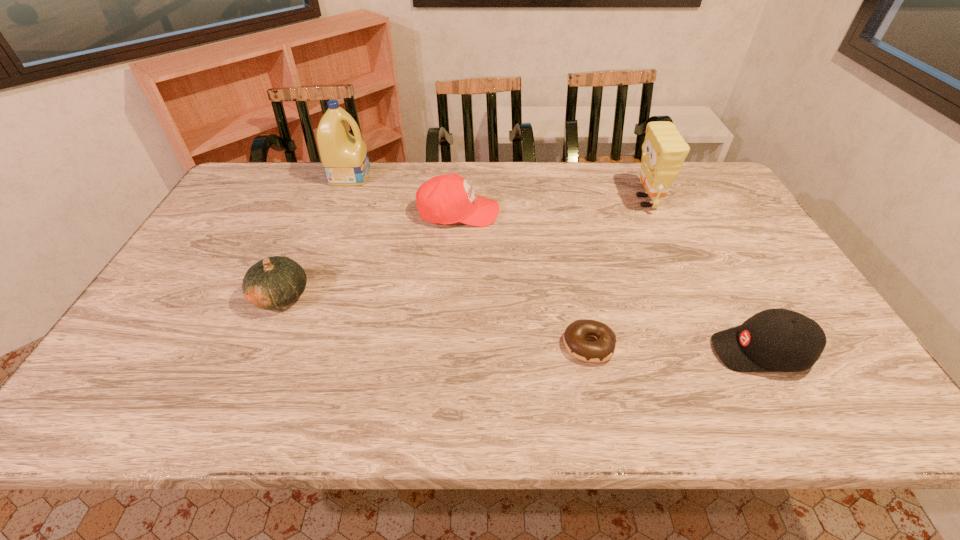
Locate an element on the screen. This screenshot has width=960, height=540. vacant space situated on the face of the sponge is located at coordinates (546, 201).

I want to click on free region located on the face of the sponge, so click(x=515, y=201).

This screenshot has width=960, height=540. Identify the location of vacant area situated 0.220m on the face of the sponge. (562, 201).

This screenshot has height=540, width=960. Find the location of `free space located 0.360m on the front panel of the left baseball cap`. free space located 0.360m on the front panel of the left baseball cap is located at coordinates (614, 213).

I want to click on vacant space located on the back of the gourd, so click(321, 205).

This screenshot has width=960, height=540. I want to click on vacant space located 0.250m with a logo on the front of the nearer baseball cap, so click(604, 352).

This screenshot has height=540, width=960. Find the location of `vacant space located 0.390m with a logo on the front of the nearer baseball cap`. vacant space located 0.390m with a logo on the front of the nearer baseball cap is located at coordinates (542, 352).

You are a GUI agent. You are given a task and a screenshot of the screen. Output one action in this format:
    pyautogui.click(x=<x>, y=<y>)
    Task: Click on the vacant space located 0.180m with a logo on the front of the nearer baseball cap
    The image size is (960, 540).
    Given the screenshot: What is the action you would take?
    pyautogui.click(x=634, y=352)

Where is `free space located 0.340m on the back of the shortest object`? This screenshot has height=540, width=960. free space located 0.340m on the back of the shortest object is located at coordinates (565, 235).

Image resolution: width=960 pixels, height=540 pixels. Find the location of `detergent located at the far edge`. detergent located at the far edge is located at coordinates (344, 157).